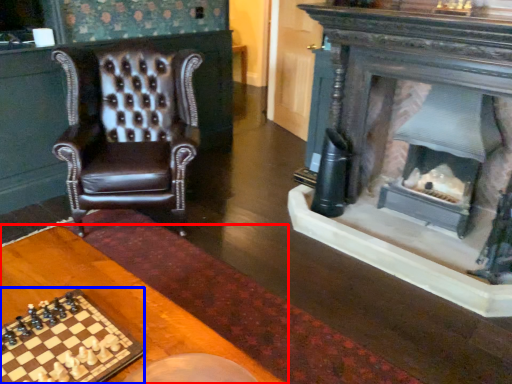
Question: Which object appears closest to the camera in this image, table (highlighted by a red box) or board game (highlighted by a blue box)?

Choices:
 (A) table
 (B) board game

Answer: (A)